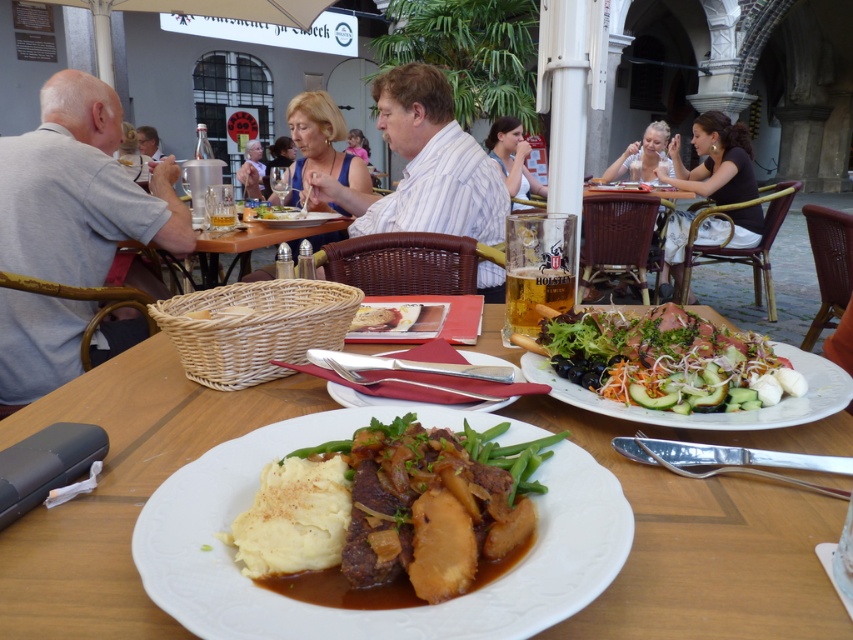
Question: Does white ceramic plate at center appear over black fabric dress at upper right?

Choices:
 (A) yes
 (B) no

Answer: (B)

Question: Which of the following is the farthest from the observer?

Choices:
 (A) (720, 337)
 (B) (358, 314)

Answer: (B)

Question: Where is smooth skin face at center located in relation to matte black hair at upper left in the image?

Choices:
 (A) left
 (B) right

Answer: (B)

Question: Which point is closer to the camera taking this photo?

Choices:
 (A) click(263, 170)
 (B) click(488, 138)

Answer: (B)

Question: Which object is positioned farthest from the blonde hair at upper center?

Choices:
 (A) white ceramic plate at center
 (B) matte black hair at upper left

Answer: (A)

Question: Is gray cotton shirt at left to the left of smooth skin face at center from the viewer's perspective?

Choices:
 (A) yes
 (B) no

Answer: (B)